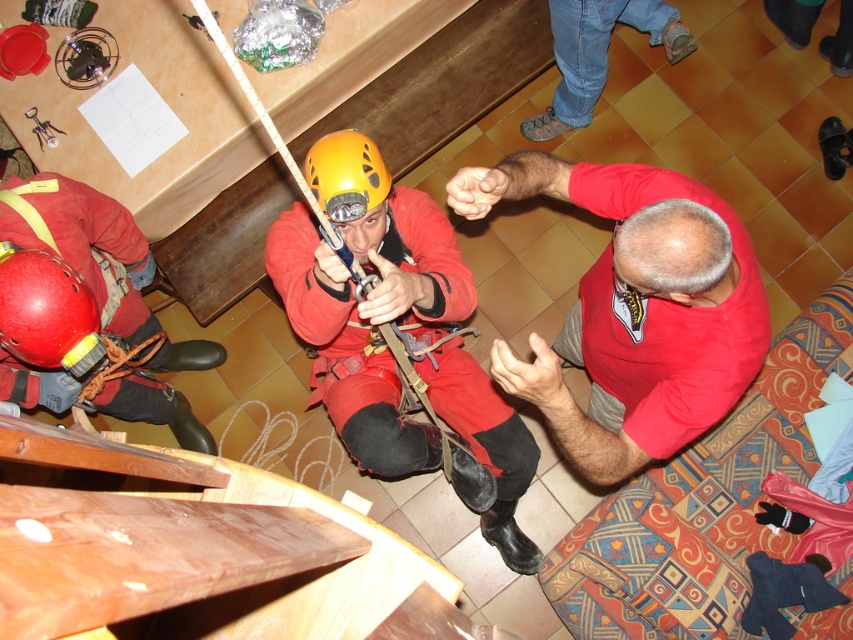
Question: Is the position of matte red climbing suit at center less distant than that of matte red helmet at lower left?

Choices:
 (A) no
 (B) yes

Answer: (A)

Question: Among these points, which one is nearest to the camera?

Choices:
 (A) (560, 42)
 (B) (727, 292)
 (C) (4, 285)

Answer: (C)

Question: Is matte red climbing suit at center further to the viewer compared to red matte helmet at lower left?

Choices:
 (A) yes
 (B) no

Answer: (B)

Question: Is matte red climbing suit at center closer to the viewer compared to matte red helmet at lower left?

Choices:
 (A) yes
 (B) no

Answer: (B)

Question: Based on their relative distances, which object is nearer to the matte red climbing suit at center?

Choices:
 (A) jeans at upper center
 (B) yellow matte helmet at center
 (C) red matte shirt at upper right

Answer: (B)

Question: Which of these objects is positioned farthest from the matte red climbing suit at center?

Choices:
 (A) matte red helmet at lower left
 (B) yellow matte helmet at center
 (C) red matte shirt at upper right
 (D) red matte helmet at lower left

Answer: (D)